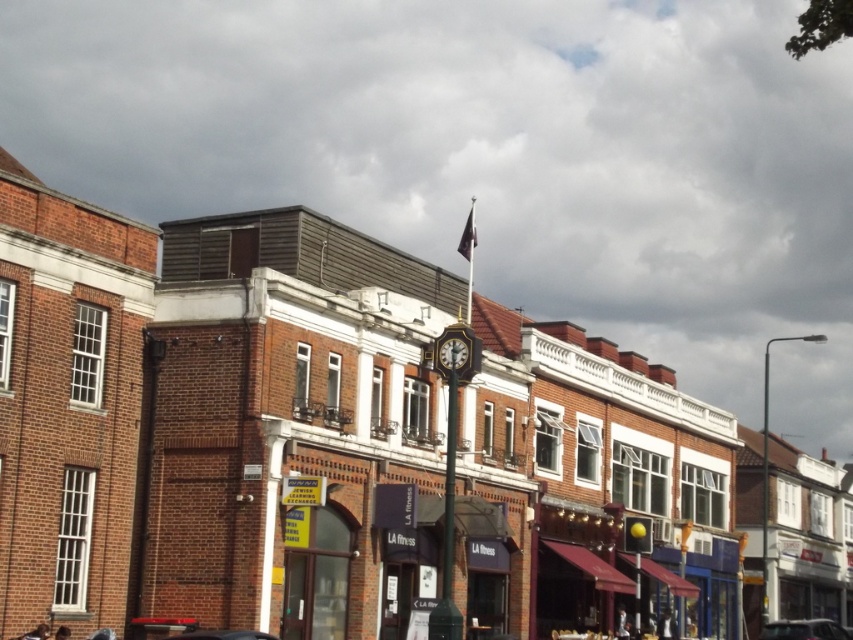
Looking at this image, you are a delivery person trying to park your metallic silver car at lower right in a parking spot that can only accommodate vehicles narrower than the gold metallic clock at center. Can your car fit in the spot?

The metallic silver car at lower right is wider than the gold metallic clock at center, so it cannot fit in the parking spot designed for narrower vehicles.